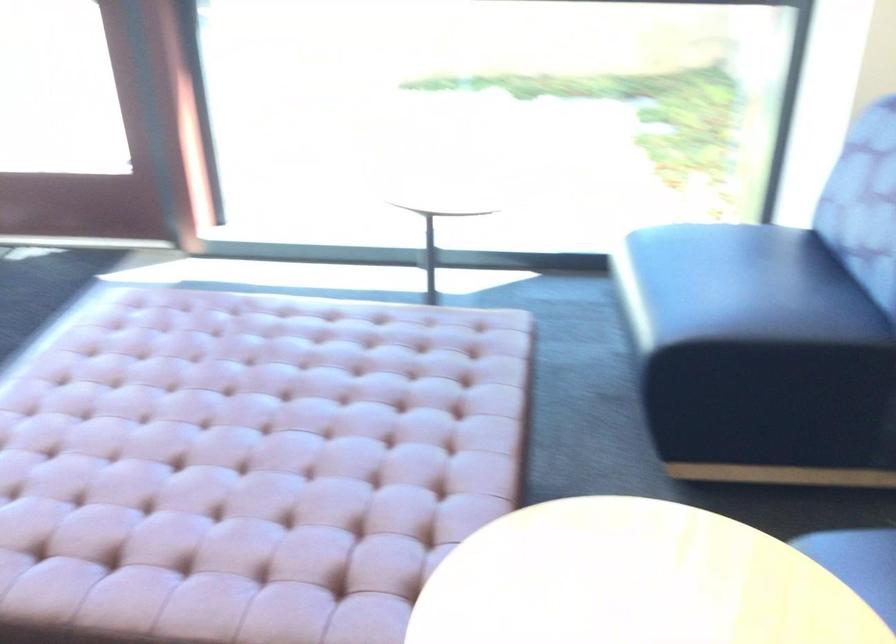
Describe the element at coordinates (306, 406) in the screenshot. The width and height of the screenshot is (896, 644). I see `the pink bench sitting surface` at that location.